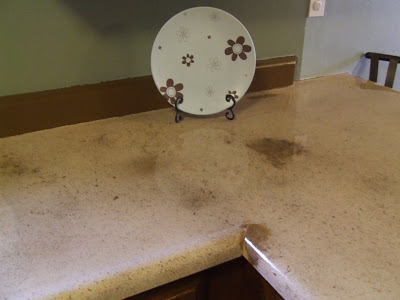
Find the location of a particular element. countertop is located at coordinates (59, 209), (312, 141), (360, 246).